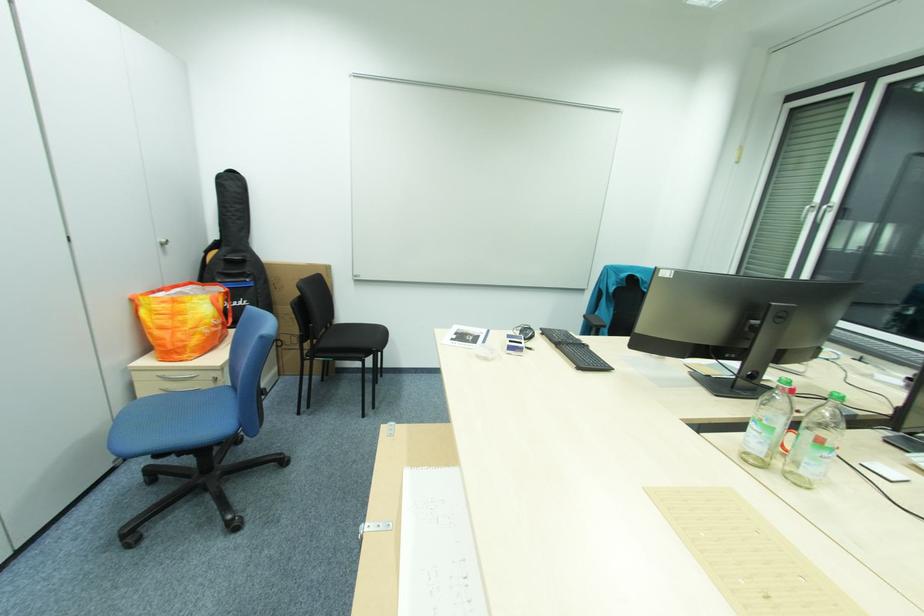
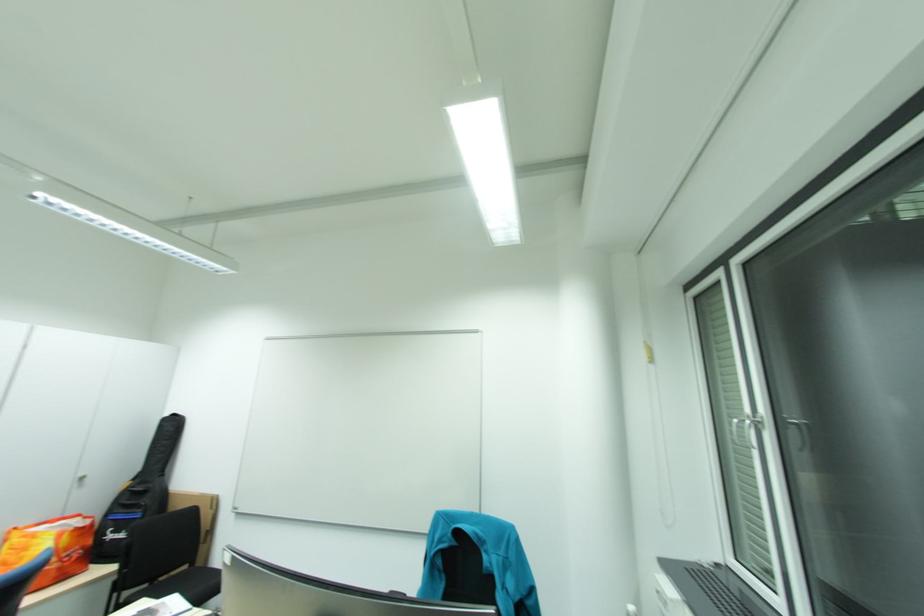
In the second image, find the point that corresponds to the point at 166,245 in the first image.

(86, 480)